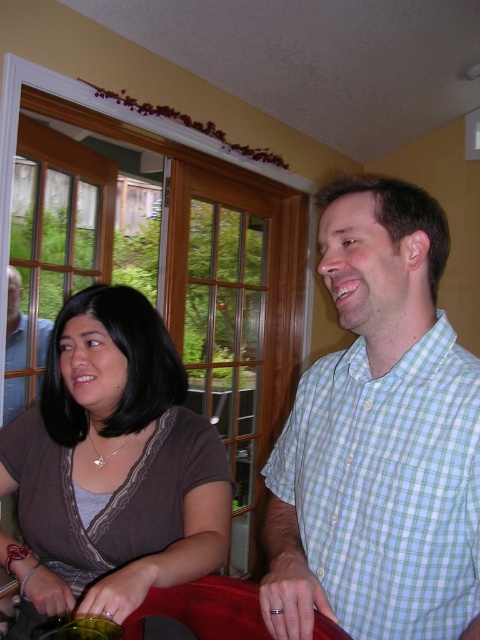
Which is below, matte brown blouse at center or matte black laptop at left?

matte brown blouse at center is below.

Between matte brown blouse at center and matte black laptop at left, which one has more height?

matte black laptop at left

Find the location of a particular element. Image resolution: width=480 pixels, height=640 pixels. matte brown blouse at center is located at coordinates (112, 465).

Can you confirm if green checkered shirt at upper right is positioned below matte black laptop at left?

Correct, green checkered shirt at upper right is located below matte black laptop at left.

Who is lower down, green checkered shirt at upper right or matte black laptop at left?

Positioned lower is green checkered shirt at upper right.

At what (x,y) coordinates should I click in order to perform the action: click on green checkered shirt at upper right. Please return your answer as a coordinate pair (x, y). The height and width of the screenshot is (640, 480). Looking at the image, I should click on (379, 438).

Does point (332, 442) lie behind point (402, 324)?

Yes, it is behind point (402, 324).

Which is below, green checkered shirt at center or green checkered shirt at upper right?

green checkered shirt at upper right

Identify the location of green checkered shirt at center. Image resolution: width=480 pixels, height=640 pixels. (379, 440).